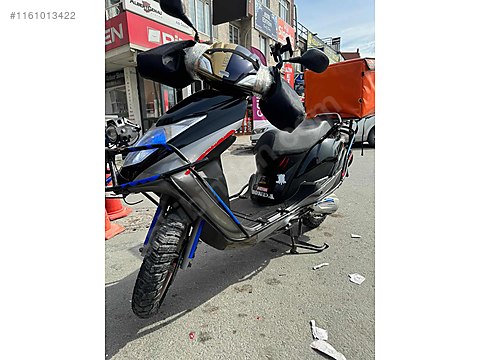
The image size is (480, 360). Identify the location of seat. (308, 128).